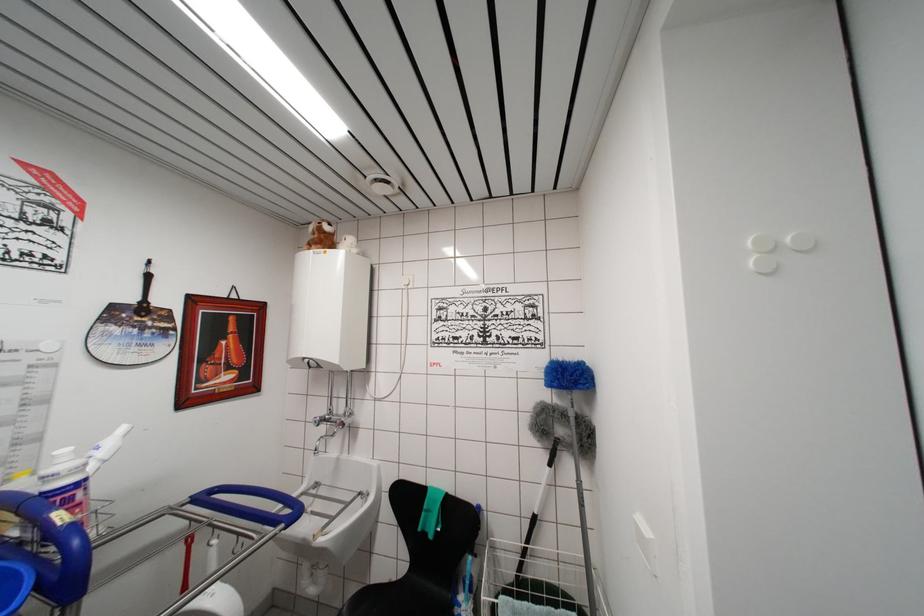
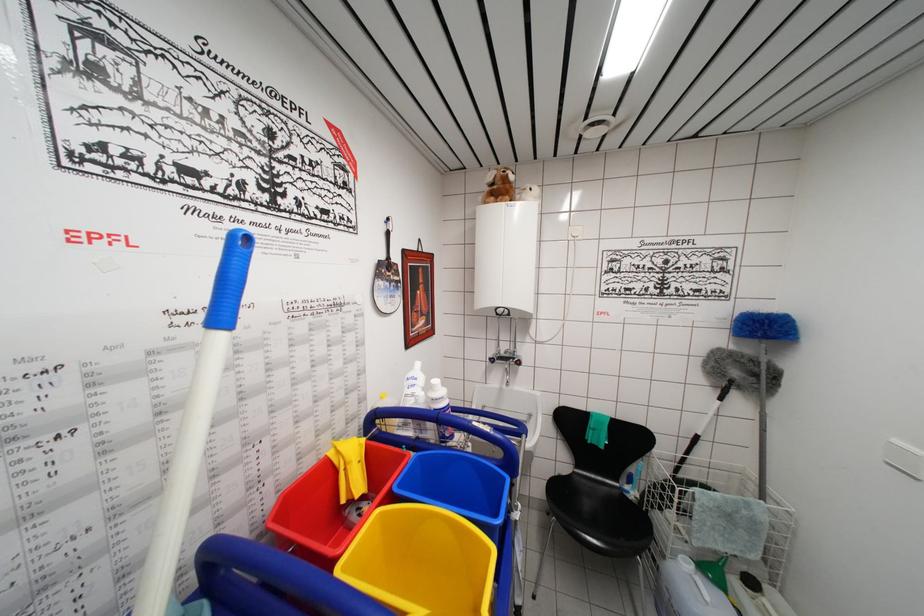
Question: In a continuous first-person perspective shot, in which direction is the camera moving?

Choices:
 (A) Left
 (B) Right
 (C) Forward
 (D) Backward

Answer: (A)